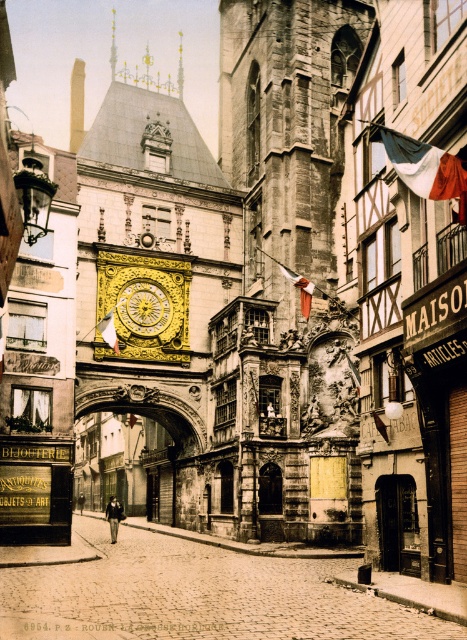
You are an architect examining a historic building. You notice a gold ornate archway at center located at point (125, 465). Is this archway part of the clock structure or the building facade?

The gold ornate archway at center located at point (125, 465) is part of the building facade, as it is situated above an arched and framed by decorative stonework around the clock.

You are an architect examining the historic street scene. You need to determine the position of the stone textured tower at center relative to the clock. Can you tell me if the tower is above or below the clock?

The stone textured tower at center is located at point coordinates that place it below the clock since the clock is situated above an arched structure on the building facade.